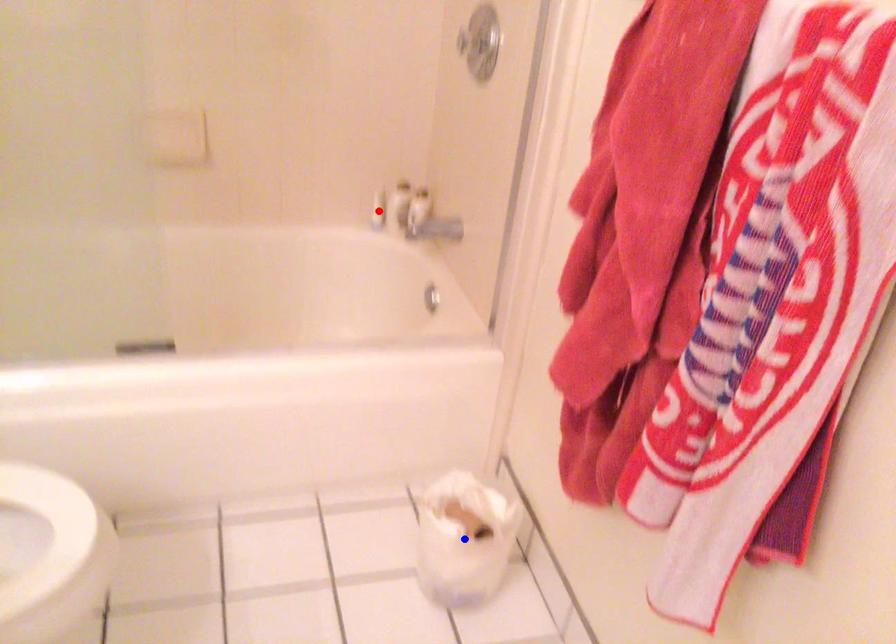
Question: Two points are marked on the image. Which point is closer to the camera?

Choices:
 (A) Blue point is closer.
 (B) Red point is closer.

Answer: (A)